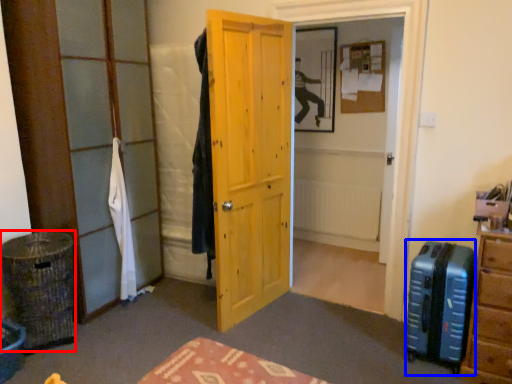
Question: Among these objects, which one is nearest to the camera, laundry basket (highlighted by a red box) or luggage (highlighted by a blue box)?

Choices:
 (A) laundry basket
 (B) luggage

Answer: (B)